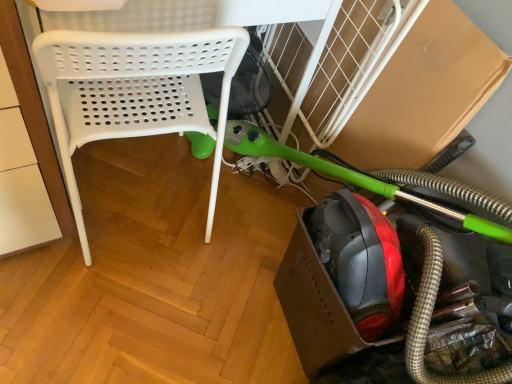
What do you see at coordinates (134, 92) in the screenshot?
I see `white plastic chair at left` at bounding box center [134, 92].

At what (x,y) coordinates should I click in order to perform the action: click on white plastic chair at left. Please return your answer as a coordinate pair (x, y). The image size is (512, 384). Looking at the image, I should click on (134, 92).

Locate an element on the screen. This screenshot has width=512, height=384. green rubber garden hose at lower right is located at coordinates (345, 175).

In order to face green rubber garden hose at lower right, should I rotate leftwards or rightwards?

Turn right approximately 18.145 degrees to face it.

What do you see at coordinates (345, 175) in the screenshot? The image size is (512, 384). I see `green rubber garden hose at lower right` at bounding box center [345, 175].

Locate an element on the screen. white plastic chair at left is located at coordinates [x=134, y=92].

Considering the positions of objects white plastic chair at left and green rubber garden hose at lower right in the image provided, who is more to the left, white plastic chair at left or green rubber garden hose at lower right?

Positioned to the left is white plastic chair at left.

Is white plastic chair at left closer to camera compared to green rubber garden hose at lower right?

No, it is not.

Which is in front, point (65, 59) or point (486, 377)?

The point (65, 59) is in front.

From the image's perspective, which is below, white plastic chair at left or green rubber garden hose at lower right?

green rubber garden hose at lower right appears lower in the image.

From a real-world perspective, is white plastic chair at left below green rubber garden hose at lower right?

No, from a real-world perspective, white plastic chair at left is not below green rubber garden hose at lower right.

Is white plastic chair at left wider than green rubber garden hose at lower right?

Yes, white plastic chair at left is wider than green rubber garden hose at lower right.

Considering the sizes of white plastic chair at left and green rubber garden hose at lower right in the image, is white plastic chair at left taller or shorter than green rubber garden hose at lower right?

In the image, white plastic chair at left appears to be taller than green rubber garden hose at lower right.

Is white plastic chair at left smaller than green rubber garden hose at lower right?

Incorrect, white plastic chair at left is not smaller in size than green rubber garden hose at lower right.

Would you say white plastic chair at left contains green rubber garden hose at lower right?

No, green rubber garden hose at lower right is not a part of white plastic chair at left.

Is white plastic chair at left next to green rubber garden hose at lower right and touching it?

No, white plastic chair at left is not in contact with green rubber garden hose at lower right.

Is white plastic chair at left facing towards green rubber garden hose at lower right?

No, white plastic chair at left is not aimed at green rubber garden hose at lower right.

Measure the distance from white plastic chair at left to green rubber garden hose at lower right.

white plastic chair at left is 15.99 inches from green rubber garden hose at lower right.

The image size is (512, 384). In order to click on chair above the green rubber garden hose at lower right (from the image's perspective) in this screenshot , I will do `click(134, 92)`.

Is green rubber garden hose at lower right at the left side of white plastic chair at left?

No, green rubber garden hose at lower right is not to the left of white plastic chair at left.

Which object is further away from the camera taking this photo, green rubber garden hose at lower right or white plastic chair at left?

white plastic chair at left is more distant.

Is point (452, 380) closer or farther from the camera than point (146, 115)?

Point (452, 380) is closer to the camera than point (146, 115).

From the image's perspective, is green rubber garden hose at lower right positioned above or below white plastic chair at left?

Based on their image positions, green rubber garden hose at lower right is located beneath white plastic chair at left.

From a real-world perspective, is green rubber garden hose at lower right positioned above or below white plastic chair at left?

Clearly, from a real-world perspective, green rubber garden hose at lower right is below white plastic chair at left.

In terms of width, does green rubber garden hose at lower right look wider or thinner when compared to white plastic chair at left?

Clearly, green rubber garden hose at lower right has less width compared to white plastic chair at left.

Who is taller, green rubber garden hose at lower right or white plastic chair at left?

Standing taller between the two is white plastic chair at left.

Looking at this image, does green rubber garden hose at lower right have a larger size compared to white plastic chair at left?

Incorrect, green rubber garden hose at lower right is not larger than white plastic chair at left.

Based on the photo, can we say green rubber garden hose at lower right lies outside white plastic chair at left?

Yes, green rubber garden hose at lower right is not within white plastic chair at left.

Is green rubber garden hose at lower right beside white plastic chair at left?

No, green rubber garden hose at lower right is not in contact with white plastic chair at left.

Is green rubber garden hose at lower right facing away from white plastic chair at left?

No, green rubber garden hose at lower right is not facing away from white plastic chair at left.

What's the angular difference between green rubber garden hose at lower right and white plastic chair at left's facing directions?

green rubber garden hose at lower right and white plastic chair at left are facing 93.6 degrees away from each other.

Where is `chair behind the green rubber garden hose at lower right`? The height and width of the screenshot is (384, 512). chair behind the green rubber garden hose at lower right is located at coordinates (134, 92).

What are the coordinates of `garden hose below the white plastic chair at left (from the image's perspective)` in the screenshot? It's located at (345, 175).

The image size is (512, 384). Identify the location of garden hose in front of the white plastic chair at left. (345, 175).